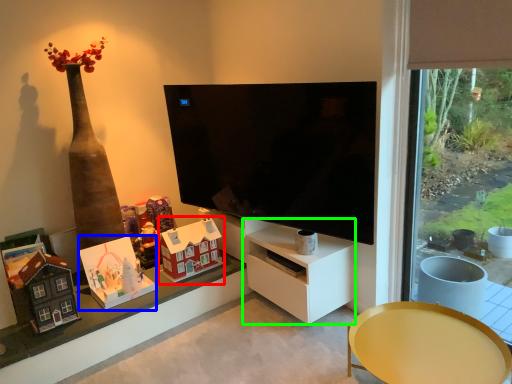
Question: Which object is the farthest from toy (highlighted by a red box)? Choose among these: toy (highlighted by a blue box) or tv cabinet (highlighted by a green box).

Choices:
 (A) toy
 (B) tv cabinet

Answer: (B)